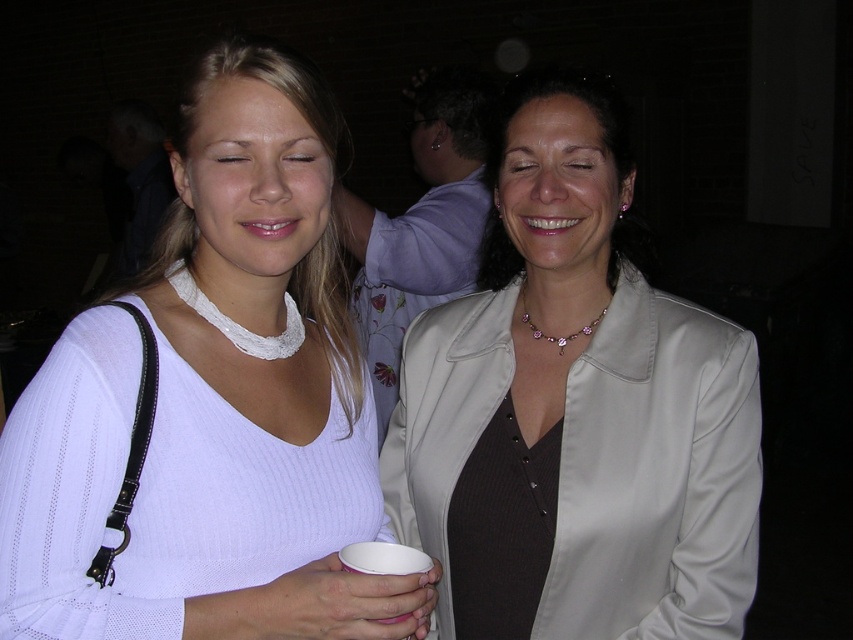
Based on the photo, you are a photographer trying to focus on the woman wearing the satin beige blazer at center. However, the white ribbed sweater at center is blocking your view. Can you move your camera slightly to the right to capture the blazer without the sweater obstructing it?

The white ribbed sweater at center is closer to the viewer than the satin beige blazer at center, so moving the camera to the right might not help as the sweater is in front. You might need to move around to the left side to get a clearer view of the blazer.

You are a photographer who needs to decide which clothing item to highlight in your photo. The scene has two women at the center wearing the white ribbed sweater at center and the satin beige blazer at center. Which clothing item would you choose to focus on if you want to emphasize size differences between them?

The white ribbed sweater at center is bigger than the satin beige blazer at center, so focusing on the white ribbed sweater at center would better emphasize the size difference between the two clothing items.